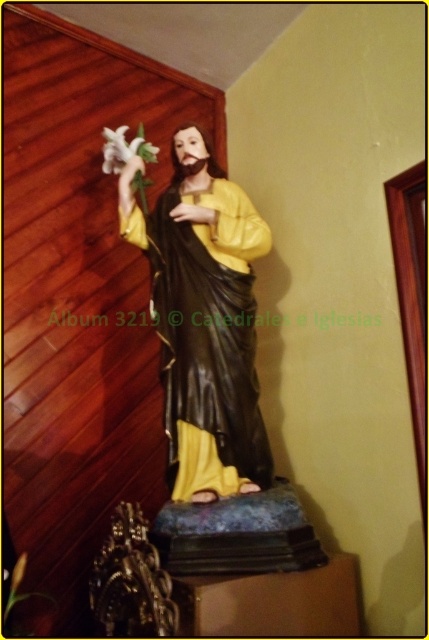
You are a tour guide explaining the statue to visitors. You want to point out two specific points on the statue. The first point is at coordinate point (x=217, y=282), and the second point is at coordinate point (x=120, y=152). From the visitors perspective, which point is closer to them?

Point (x=217, y=282) is in front of point (x=120, y=152), so the first point is closer to the visitors.

You are an art student analyzing the statue. You notice the matte yellow fabric at center and the white matte lily at upper left. Which object is located to the right of the other?

The matte yellow fabric at center is positioned on the right side of white matte lily at upper left.

You are a sculptor working on a statue. You have to place a small golden plaque between the matte yellow fabric at center and the white matte lily at upper left. The plaque is 3 inches wide. Can you fit it between them without overlapping either object?

The distance between the matte yellow fabric at center and the white matte lily at upper left is 13.76 inches. Since the plaque is only 3 inches wide, there is enough space to place it between them without overlapping either object.